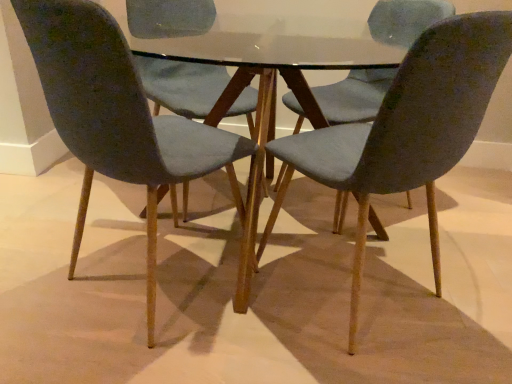
Question: Is matte blue chair at center, placed as the third chair when sorted from left to right, oriented away from glass table at center?

Choices:
 (A) no
 (B) yes

Answer: (B)

Question: From a real-world perspective, is matte blue chair at center, placed as the third chair when sorted from left to right, over glass table at center?

Choices:
 (A) no
 (B) yes

Answer: (B)

Question: Is matte blue chair at center, placed as the third chair when sorted from left to right, smaller than glass table at center?

Choices:
 (A) no
 (B) yes

Answer: (B)

Question: Considering the relative sizes of matte blue chair at center, which is the first chair from right to left, and glass table at center in the image provided, is matte blue chair at center, which is the first chair from right to left, bigger than glass table at center?

Choices:
 (A) no
 (B) yes

Answer: (A)

Question: Is matte blue chair at center, placed as the third chair when sorted from left to right, taller than glass table at center?

Choices:
 (A) no
 (B) yes

Answer: (B)

Question: From the image's perspective, is matte gray chair at left, which appears as the 3th chair when viewed from the right, located above or below glass table at center?

Choices:
 (A) below
 (B) above

Answer: (A)

Question: From a real-world perspective, is matte gray chair at left, which appears as the 3th chair when viewed from the right, physically located above or below glass table at center?

Choices:
 (A) above
 (B) below

Answer: (A)

Question: Is matte gray chair at left, the first chair viewed from the left, in front of or behind glass table at center in the image?

Choices:
 (A) behind
 (B) front

Answer: (B)

Question: Is matte gray chair at left, which appears as the 3th chair when viewed from the right, taller or shorter than glass table at center?

Choices:
 (A) short
 (B) tall

Answer: (B)

Question: In terms of size, does velvet blue chair at center, which appears as the second chair when viewed from the left, appear bigger or smaller than matte gray chair at left, the first chair viewed from the left?

Choices:
 (A) big
 (B) small

Answer: (B)

Question: From the image's perspective, is velvet blue chair at center, which appears as the second chair when viewed from the left, above or below matte gray chair at left, which appears as the 3th chair when viewed from the right?

Choices:
 (A) above
 (B) below

Answer: (A)

Question: Is velvet blue chair at center, the 2th chair from the right, taller or shorter than matte gray chair at left, the first chair viewed from the left?

Choices:
 (A) short
 (B) tall

Answer: (A)

Question: Is velvet blue chair at center, the 2th chair from the right, in front of or behind matte gray chair at left, the first chair viewed from the left, in the image?

Choices:
 (A) behind
 (B) front

Answer: (A)

Question: Is velvet blue chair at center, the 2th chair from the right, taller or shorter than matte blue chair at center, which is the first chair from right to left?

Choices:
 (A) short
 (B) tall

Answer: (A)

Question: In the image, is velvet blue chair at center, which appears as the second chair when viewed from the left, on the left side or the right side of matte blue chair at center, which is the first chair from right to left?

Choices:
 (A) left
 (B) right

Answer: (A)